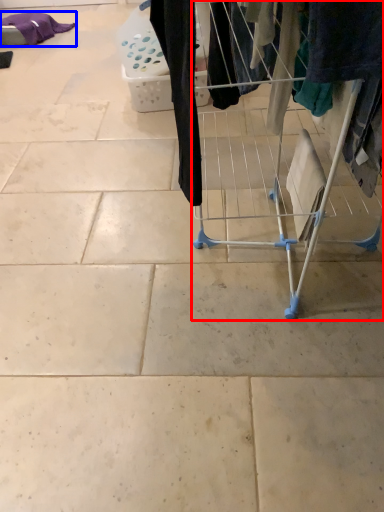
Question: Which object is closer to the camera taking this photo, furniture (highlighted by a red box) or clothing (highlighted by a blue box)?

Choices:
 (A) furniture
 (B) clothing

Answer: (A)